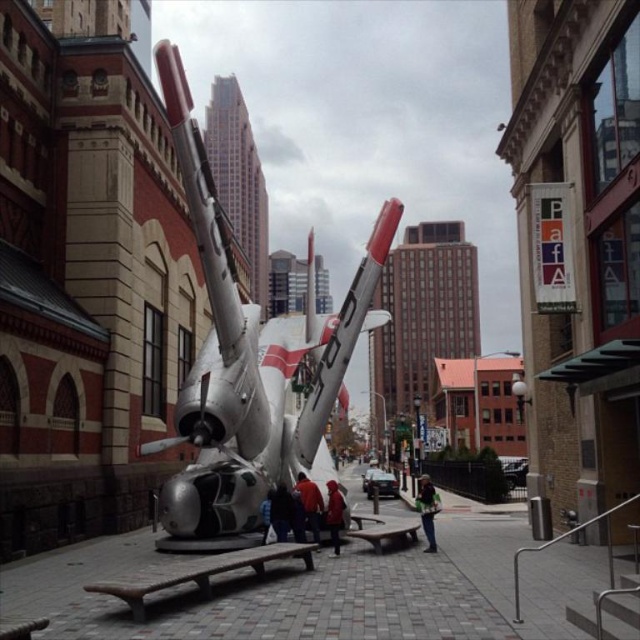
In the scene shown: Which of these two, green fabric jacket at center or red jacket at center, stands shorter?

Standing shorter between the two is red jacket at center.

Does green fabric jacket at center appear on the right side of red jacket at center?

Correct, you'll find green fabric jacket at center to the right of red jacket at center.

Where is `green fabric jacket at center`? green fabric jacket at center is located at coordinates (428, 509).

Is point (307, 525) in front of point (326, 515)?

Yes, point (307, 525) is closer to viewer.

Between point (308, 515) and point (333, 536), which one is positioned behind?

Positioned behind is point (333, 536).

Between point (296, 476) and point (333, 528), which one is positioned behind?

Positioned behind is point (296, 476).

Where is `red fabric jacket at center`? The width and height of the screenshot is (640, 640). red fabric jacket at center is located at coordinates (308, 502).

Who is taller, green fabric jacket at center or blue denim jacket at center?

Standing taller between the two is green fabric jacket at center.

Measure the distance between green fabric jacket at center and camera.

green fabric jacket at center and camera are 209.43 feet apart.

Which is in front, point (419, 497) or point (266, 499)?

Point (266, 499) is more forward.

Identify the location of green fabric jacket at center. (428, 509).